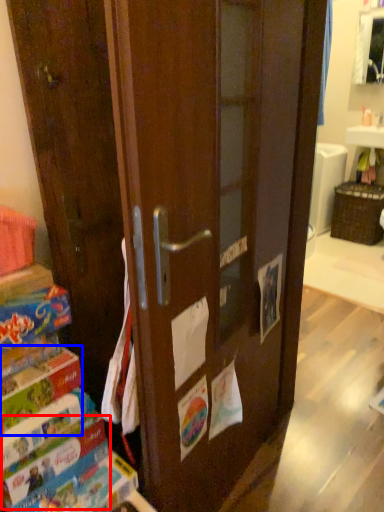
Question: Among these objects, which one is farthest to the camera, paperback book (highlighted by a red box) or paperback book (highlighted by a blue box)?

Choices:
 (A) paperback book
 (B) paperback book

Answer: (A)